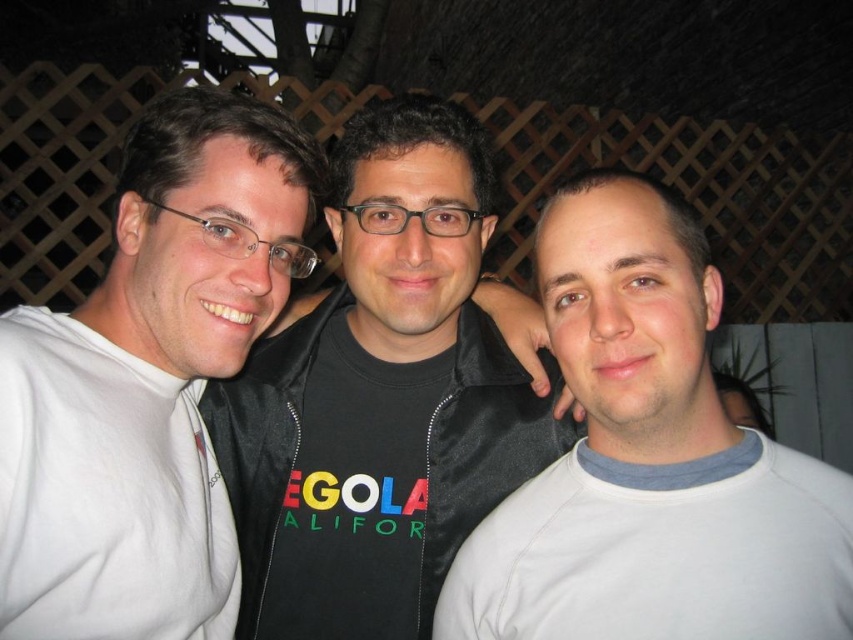
Question: Is white matte shirt at center closer to the viewer compared to white cotton shirt at right?

Choices:
 (A) yes
 (B) no

Answer: (A)

Question: Is white matte shirt at left wider than white cotton shirt at left?

Choices:
 (A) no
 (B) yes

Answer: (B)

Question: Estimate the real-world distances between objects in this image. Which object is closer to the black matte jacket at center?

Choices:
 (A) white cotton shirt at right
 (B) white cotton shirt at left
 (C) white matte shirt at center
 (D) white matte shirt at left

Answer: (D)

Question: Which point is farther from the camera taking this photo?

Choices:
 (A) (567, 515)
 (B) (660, 547)
 (C) (422, 481)
 (D) (119, 492)

Answer: (C)

Question: Does black matte jacket at center appear on the right side of white cotton shirt at right?

Choices:
 (A) no
 (B) yes

Answer: (A)

Question: Which point appears closest to the camera in this image?

Choices:
 (A) (54, 401)
 (B) (624, 593)

Answer: (B)